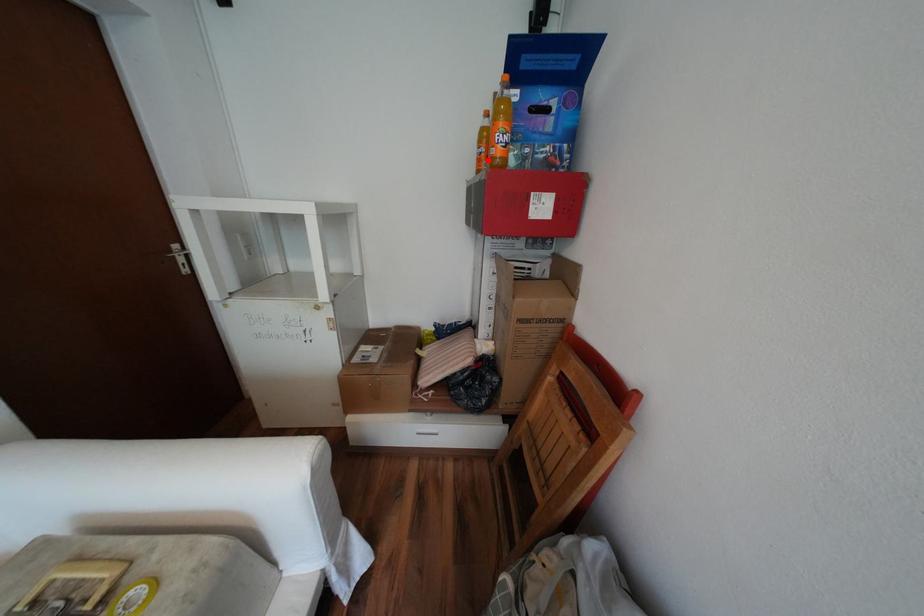
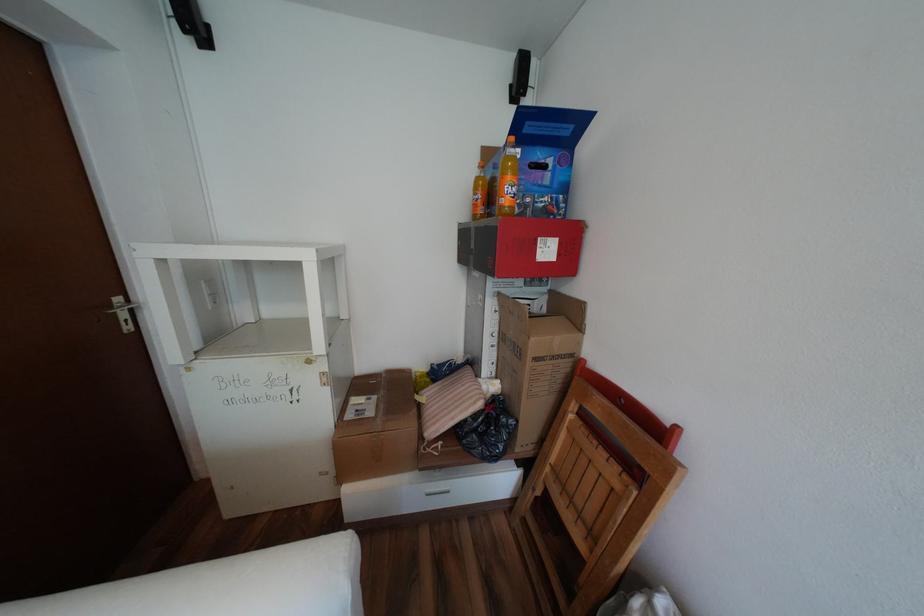
Locate, in the second image, the point that corresponds to the highlighted location in the first image.

(484, 206)